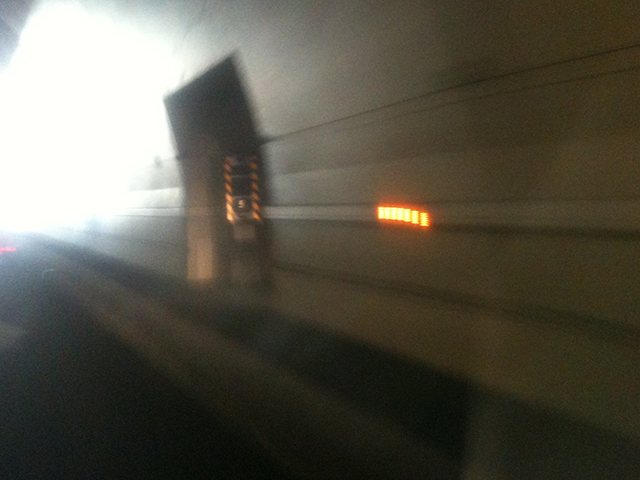
Where is `orange light`? This screenshot has height=480, width=640. orange light is located at coordinates [x=401, y=216].